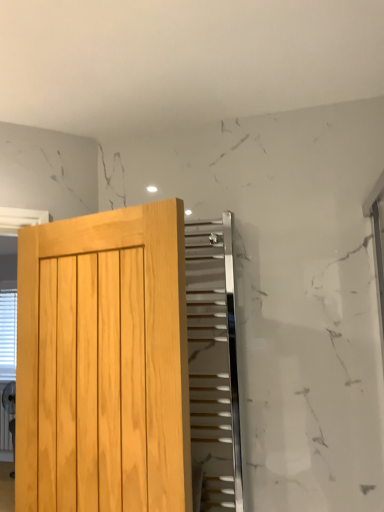
Measure the distance between point (7, 292) and camera.

The depth of point (7, 292) is 1.66 meters.

Find the location of a particular element. The height and width of the screenshot is (512, 384). light wood door at left is located at coordinates (103, 362).

Looking at this image, is polished chrome radiator at upper center outside of light wood door at left?

Indeed, polished chrome radiator at upper center is completely outside light wood door at left.

Is point (187, 302) in front of point (71, 337)?

No, it is not.

Who is smaller, polished chrome radiator at upper center or light wood door at left?

polished chrome radiator at upper center.

Does polished chrome radiator at upper center appear on the left side of light wood door at left?

No.

Which object is closer to the camera taking this photo, white plastic blinds at left or polished chrome radiator at upper center?

polished chrome radiator at upper center is more forward.

Is point (7, 354) farther from camera compared to point (196, 359)?

That is True.

Is white plastic blinds at left smaller than light wood door at left?

No.

Is white plastic blinds at left positioned beyond the bounds of light wood door at left?

Yes, white plastic blinds at left is not within light wood door at left.

From the image's perspective, which one is positioned higher, white plastic blinds at left or light wood door at left?

light wood door at left, from the image's perspective.

Is white plastic blinds at left facing away from light wood door at left?

No, white plastic blinds at left's orientation is not away from light wood door at left.

Find the location of a particular element. door lying on the left of polished chrome radiator at upper center is located at coordinates (103, 362).

From the image's perspective, which is below, light wood door at left or polished chrome radiator at upper center?

polished chrome radiator at upper center is shown below in the image.

How many degrees apart are the facing directions of light wood door at left and polished chrome radiator at upper center?

The angular difference between light wood door at left and polished chrome radiator at upper center is 17.5 degrees.

Would you consider light wood door at left to be distant from polished chrome radiator at upper center?

light wood door at left is actually quite close to polished chrome radiator at upper center.

Visually, is polished chrome radiator at upper center positioned to the left or to the right of white plastic blinds at left?

In the image, polished chrome radiator at upper center appears on the right side of white plastic blinds at left.

From a real-world perspective, is polished chrome radiator at upper center above or below white plastic blinds at left?

polished chrome radiator at upper center is situated higher than white plastic blinds at left in the real world.

Is polished chrome radiator at upper center oriented away from white plastic blinds at left?

No.

Who is taller, polished chrome radiator at upper center or white plastic blinds at left?

Standing taller between the two is white plastic blinds at left.

Looking at this image, is light wood door at left directly adjacent to white plastic blinds at left?

No, light wood door at left is not next to white plastic blinds at left.

How different are the orientations of light wood door at left and white plastic blinds at left in degrees?

19.1 degrees.

In order to click on blind that is below the light wood door at left (from the image's perspective) in this screenshot , I will do `click(8, 334)`.

Where is `door on the left of polished chrome radiator at upper center`? door on the left of polished chrome radiator at upper center is located at coordinates (103, 362).

The width and height of the screenshot is (384, 512). Identify the location of elevator above the white plastic blinds at left (from the image's perspective). (213, 366).

Based on the photo, from the image, which object appears to be farther from polished chrome radiator at upper center, light wood door at left or white plastic blinds at left?

white plastic blinds at left.

Considering their positions, is polished chrome radiator at upper center positioned further to white plastic blinds at left than light wood door at left?

Based on the image, polished chrome radiator at upper center appears to be further to white plastic blinds at left.

Considering their positions, is white plastic blinds at left positioned closer to polished chrome radiator at upper center than light wood door at left?

light wood door at left lies closer to polished chrome radiator at upper center than the other object.

Looking at the image, which one is located further to white plastic blinds at left, light wood door at left or polished chrome radiator at upper center?

Among the two, polished chrome radiator at upper center is located further to white plastic blinds at left.

Based on their spatial positions, is white plastic blinds at left or polished chrome radiator at upper center closer to light wood door at left?

Among the two, white plastic blinds at left is located nearer to light wood door at left.

Looking at the image, which one is located further to light wood door at left, polished chrome radiator at upper center or white plastic blinds at left?

polished chrome radiator at upper center is further to light wood door at left.

The width and height of the screenshot is (384, 512). I want to click on elevator between light wood door at left and white plastic blinds at left along the z-axis, so click(213, 366).